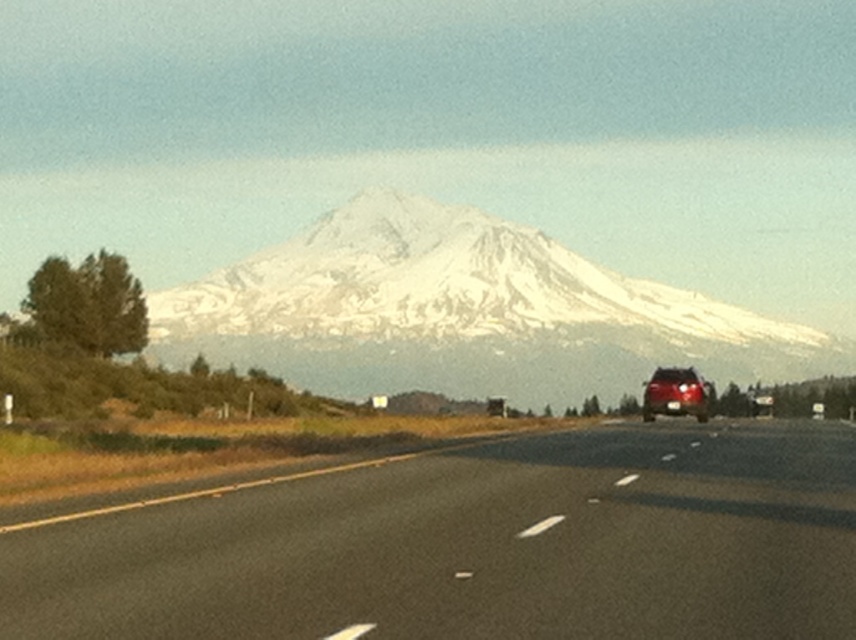
Question: Which point appears farthest from the camera in this image?

Choices:
 (A) (690, 374)
 (B) (708, 541)

Answer: (A)

Question: Which point is closer to the camera?

Choices:
 (A) (355, 518)
 (B) (669, 394)

Answer: (A)

Question: Does black asphalt road at center lie behind satin red suv at center?

Choices:
 (A) yes
 (B) no

Answer: (B)

Question: Does black asphalt road at center appear over satin red suv at center?

Choices:
 (A) no
 (B) yes

Answer: (A)

Question: Can you confirm if black asphalt road at center is bigger than satin red suv at center?

Choices:
 (A) no
 (B) yes

Answer: (B)